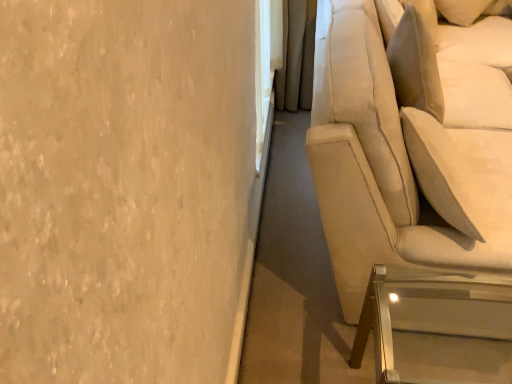
Question: From a real-world perspective, is clear acrylic table at lower right physically located above or below beige fabric couch at right?

Choices:
 (A) above
 (B) below

Answer: (B)

Question: Would you say clear acrylic table at lower right is inside or outside beige fabric couch at right?

Choices:
 (A) inside
 (B) outside

Answer: (B)

Question: Is clear acrylic table at lower right taller or shorter than beige fabric couch at right?

Choices:
 (A) tall
 (B) short

Answer: (B)

Question: Is beige fabric couch at right taller or shorter than clear acrylic table at lower right?

Choices:
 (A) short
 (B) tall

Answer: (B)

Question: In the image, is beige fabric couch at right on the left side or the right side of clear acrylic table at lower right?

Choices:
 (A) right
 (B) left

Answer: (A)

Question: Considering their positions, is beige fabric couch at right located in front of or behind clear acrylic table at lower right?

Choices:
 (A) behind
 (B) front

Answer: (B)

Question: Does point (400, 243) appear closer or farther from the camera than point (391, 377)?

Choices:
 (A) closer
 (B) farther

Answer: (B)